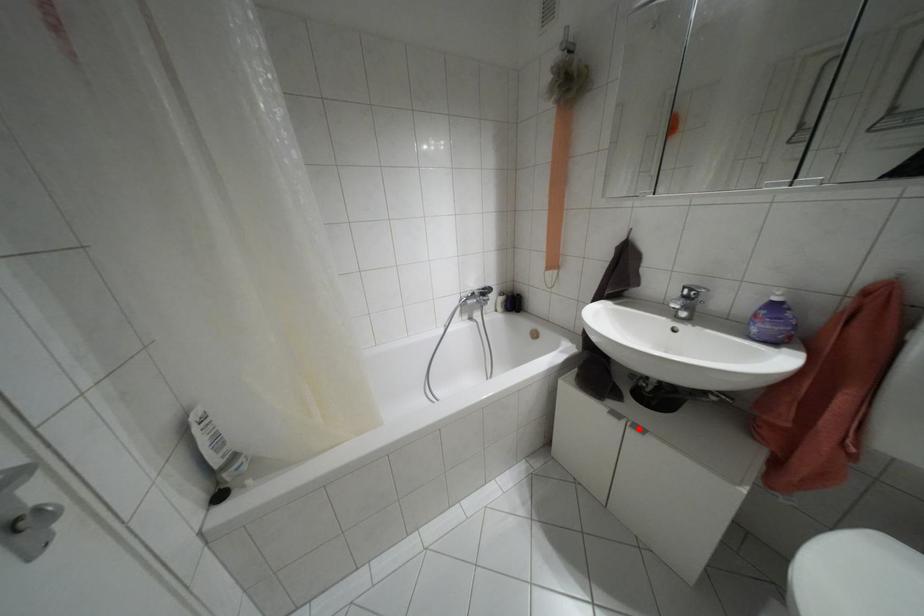
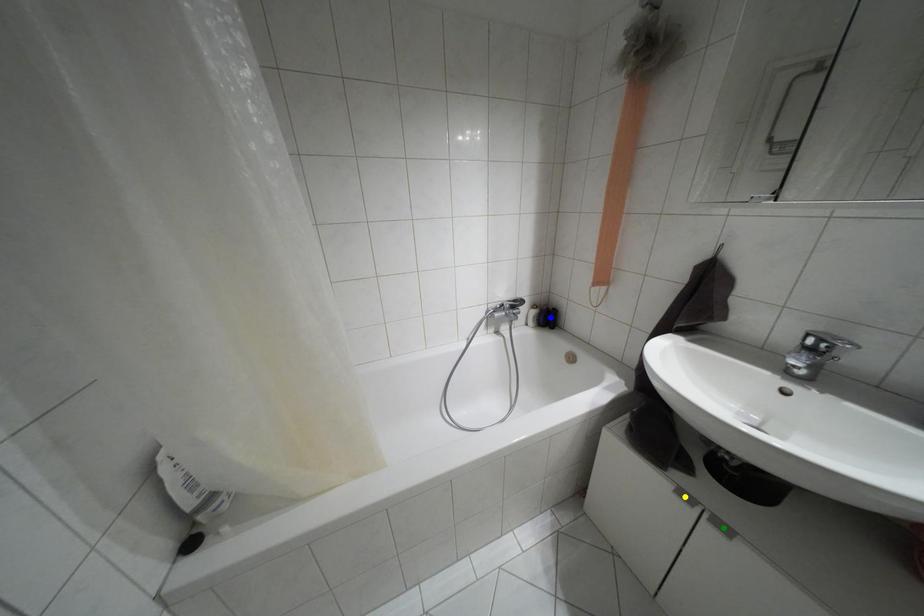
Question: I am providing you with two images of the same scene from different viewpoints. A red point is marked on the first image. You are given multiple points on the second image. Which point in image 2 is actually the same real-world point as the red point in image 1?

Choices:
 (A) yellow point
 (B) blue point
 (C) green point

Answer: (C)